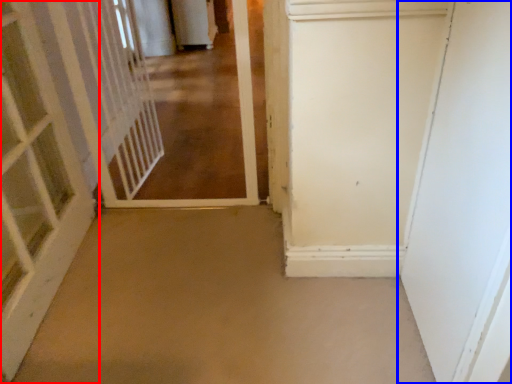
Question: Among these objects, which one is nearest to the camera, door (highlighted by a red box) or door (highlighted by a blue box)?

Choices:
 (A) door
 (B) door

Answer: (B)